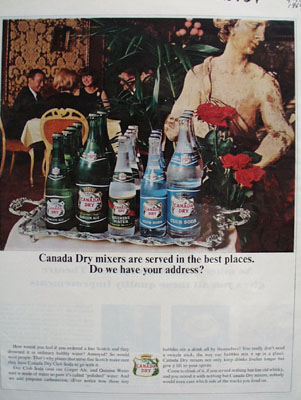
Locate an element on the screen. statue is located at coordinates (240, 54).